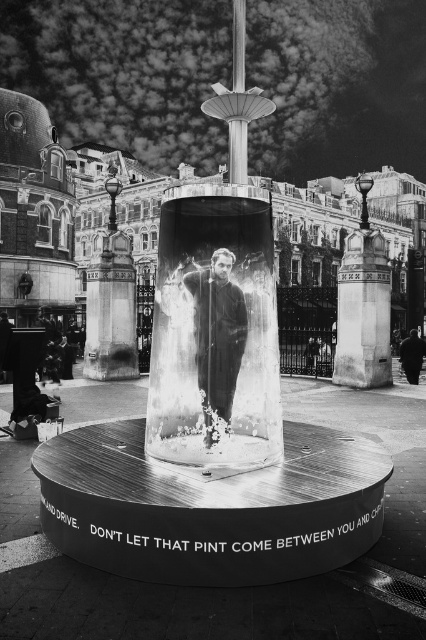
Is transparent glass cylinder at center closer to the viewer compared to smooth black suit at center?

Yes, transparent glass cylinder at center is closer to the viewer.

Who is positioned more to the left, transparent glass cylinder at center or smooth black suit at center?

transparent glass cylinder at center is more to the left.

Locate an element on the screen. The height and width of the screenshot is (640, 426). transparent glass cylinder at center is located at coordinates (215, 332).

Measure the distance between smooth black suit at center and camera.

The distance of smooth black suit at center from camera is 36.37 meters.

Can you confirm if smooth black suit at center is thinner than dark fabric jacket at lower right?

Yes, smooth black suit at center is thinner than dark fabric jacket at lower right.

This screenshot has height=640, width=426. What do you see at coordinates (218, 337) in the screenshot? I see `smooth black suit at center` at bounding box center [218, 337].

Identify the location of smooth black suit at center. (218, 337).

Based on the photo, which is below, transparent glass cylinder at center or dark fabric jacket at lower right?

dark fabric jacket at lower right is lower down.

Is the position of transparent glass cylinder at center more distant than that of dark fabric jacket at lower right?

No, it is in front of dark fabric jacket at lower right.

Is point (173, 353) farther from viewer compared to point (417, 348)?

No, it is not.

The height and width of the screenshot is (640, 426). Identify the location of transparent glass cylinder at center. (215, 332).